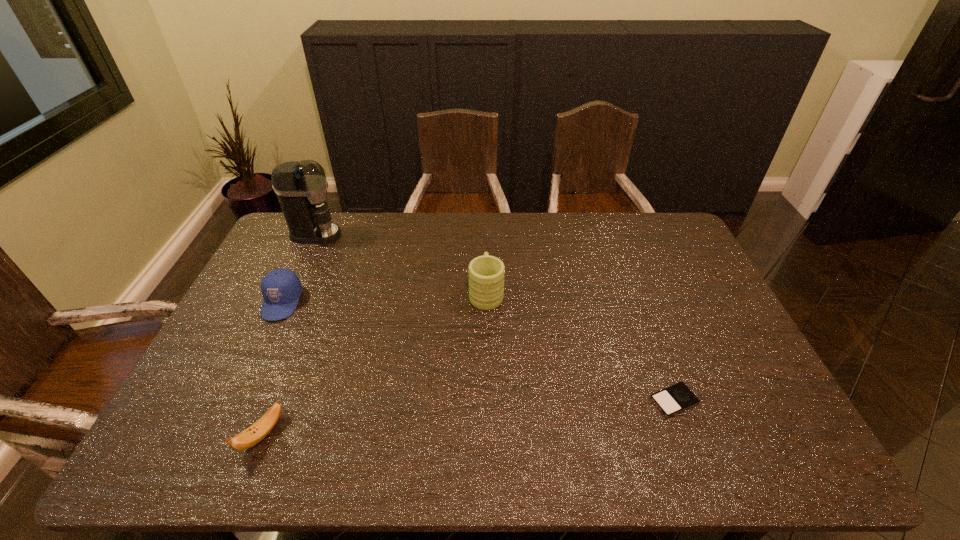
The image size is (960, 540). I want to click on vacant region at the far edge, so click(379, 229).

Image resolution: width=960 pixels, height=540 pixels. Find the location of `free location at the near edge`. free location at the near edge is located at coordinates (314, 446).

What are the coordinates of `vacant area at the left edge of the desktop` in the screenshot? It's located at (242, 365).

In the image, there is a desktop. Where is `vacant space at the right edge`? The height and width of the screenshot is (540, 960). vacant space at the right edge is located at coordinates (737, 425).

The height and width of the screenshot is (540, 960). What are the coordinates of `free region at the near left corner` in the screenshot? It's located at (159, 452).

The height and width of the screenshot is (540, 960). What are the coordinates of `blank space at the far right corner of the desktop` in the screenshot? It's located at (643, 218).

Where is `free spot between the second tallest object and the second shortest object`? free spot between the second tallest object and the second shortest object is located at coordinates (374, 363).

Locate an element on the screen. The width and height of the screenshot is (960, 540). vacant space that's between the coffee maker and the second shortest object is located at coordinates (289, 334).

Where is `free point between the banana and the second object from right to left`? Image resolution: width=960 pixels, height=540 pixels. free point between the banana and the second object from right to left is located at coordinates (374, 363).

Locate an element on the screen. Image resolution: width=960 pixels, height=540 pixels. vacant space that is in between the mug and the fourth tallest object is located at coordinates (374, 363).